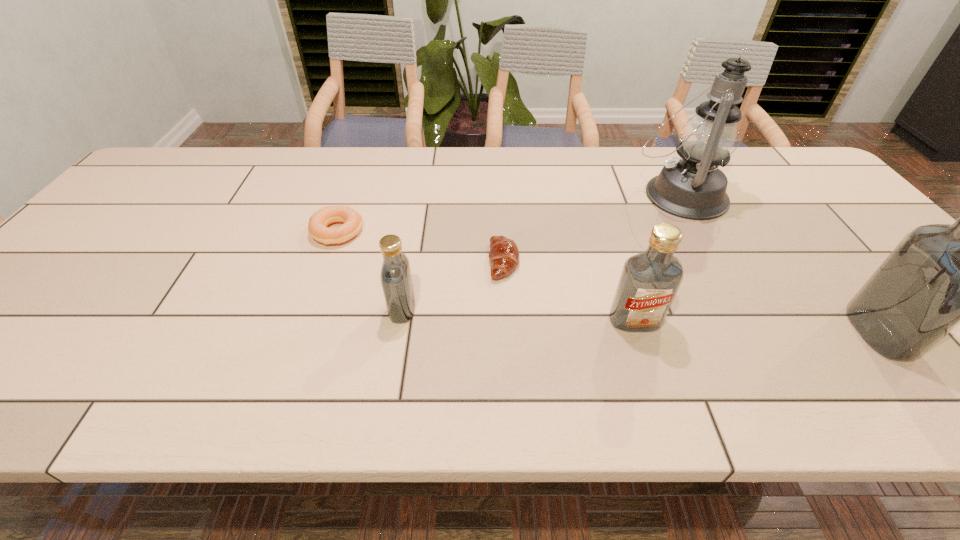
Where is `free spot between the leftmost vodka and the second tallest vodka`? free spot between the leftmost vodka and the second tallest vodka is located at coordinates (518, 315).

Locate an element on the screen. This screenshot has height=540, width=960. free spot between the bagel and the fifth object from right to left is located at coordinates (370, 271).

The height and width of the screenshot is (540, 960). I want to click on vacant point located between the leftmost object and the second vodka from left to right, so click(486, 276).

Select which object appears as the fifth closest to the tallest vodka. Please provide its 2D coordinates. Your answer should be formatted as a tuple, i.e. [(x, y)], where the tuple contains the x and y coordinates of a point satisfying the conditions above.

[(318, 222)]

Identify the location of object that is the fourth closest to the bagel. (693, 187).

Identify which vodka is located as the third nearest to the second object from right to left. Please provide its 2D coordinates. Your answer should be formatted as a tuple, i.e. [(x, y)], where the tuple contains the x and y coordinates of a point satisfying the conditions above.

[(396, 279)]

Image resolution: width=960 pixels, height=540 pixels. I want to click on the closest vodka to the second object from left to right, so click(649, 281).

The width and height of the screenshot is (960, 540). In order to click on vacant region that satisfies the following two spatial constraints: 1. on the back side of the bagel; 2. on the left side of the oil lamp in this screenshot , I will do `click(350, 195)`.

The width and height of the screenshot is (960, 540). What are the coordinates of `free spot that satisfies the following two spatial constraints: 1. on the front side of the oil lamp; 2. on the front-facing side of the leftmost vodka` in the screenshot? It's located at coord(742,309).

Locate an element on the screen. free point that satisfies the following two spatial constraints: 1. on the front side of the crescent roll; 2. on the front-facing side of the shortest vodka is located at coordinates (507, 309).